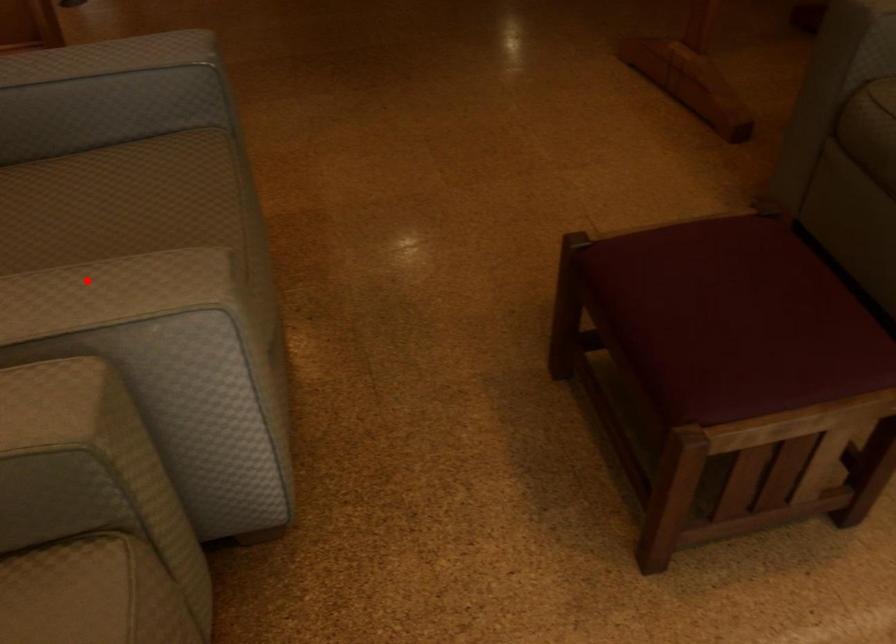
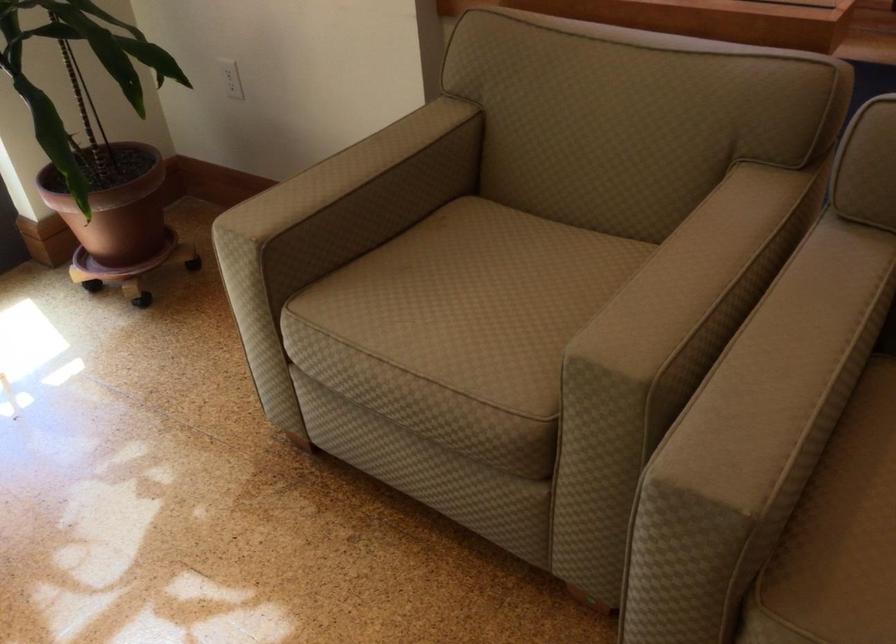
In the second image, find the point that corresponds to the highlighted location in the first image.

(773, 399)